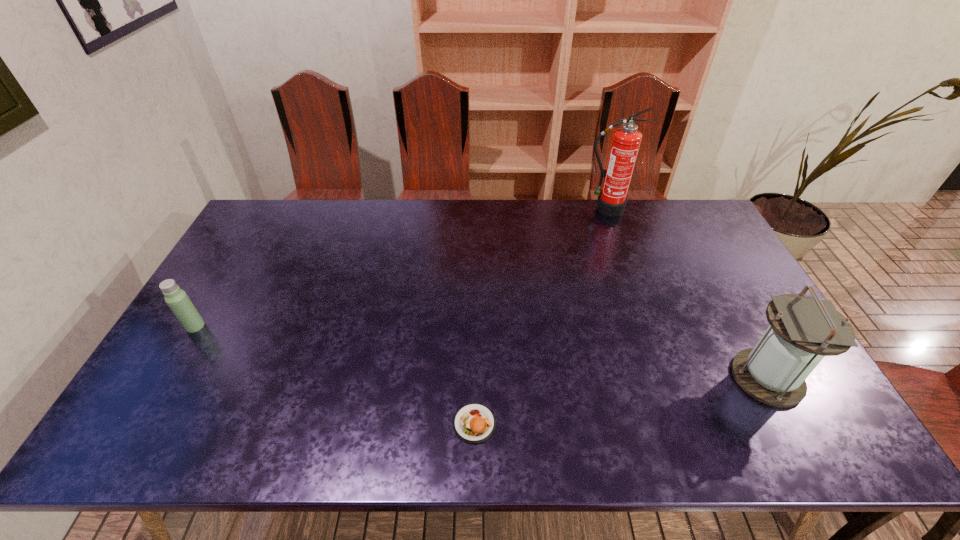
Identify the location of vacant region between the patty (food) and the farthest object. pyautogui.click(x=540, y=316).

I want to click on free spot between the lantern and the tallest object, so click(686, 293).

This screenshot has height=540, width=960. What are the coordinates of `object that is the second closest to the second farthest object` in the screenshot? It's located at tap(626, 140).

Where is `object that is the third closest to the third tallest object`? object that is the third closest to the third tallest object is located at coordinates (803, 330).

Locate an element on the screen. The height and width of the screenshot is (540, 960). vacant point that satisfies the following two spatial constraints: 1. on the front-facing side of the tallest object; 2. on the right side of the rightmost object is located at coordinates (663, 378).

Locate an element on the screen. The width and height of the screenshot is (960, 540). free space that satisfies the following two spatial constraints: 1. on the back side of the second tallest object; 2. on the left side of the patty (food) is located at coordinates (475, 378).

You are a GUI agent. You are given a task and a screenshot of the screen. Output one action in this format:
    pyautogui.click(x=<x>, y=<y>)
    Task: Click on the free space that satisfies the following two spatial constraints: 1. on the front-facing side of the fire extinguisher; 2. on the left side of the rightmost object
    
    Given the screenshot: What is the action you would take?
    click(x=663, y=378)

You are a GUI agent. You are given a task and a screenshot of the screen. Output one action in this format:
    pyautogui.click(x=<x>, y=<y>)
    Task: Click on the free region that satisfies the following two spatial constraints: 1. on the front-facing side of the fire extinguisher; 2. on the left side of the lantern
    Image resolution: width=960 pixels, height=540 pixels.
    Given the screenshot: What is the action you would take?
    pyautogui.click(x=663, y=378)